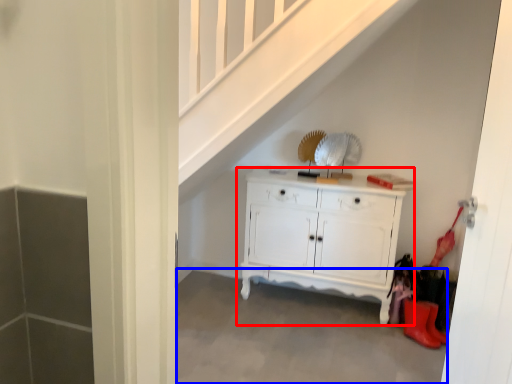
Question: Which object appears closest to the camera in this image, chest of drawers (highlighted by a red box) or concrete (highlighted by a blue box)?

Choices:
 (A) chest of drawers
 (B) concrete

Answer: (B)